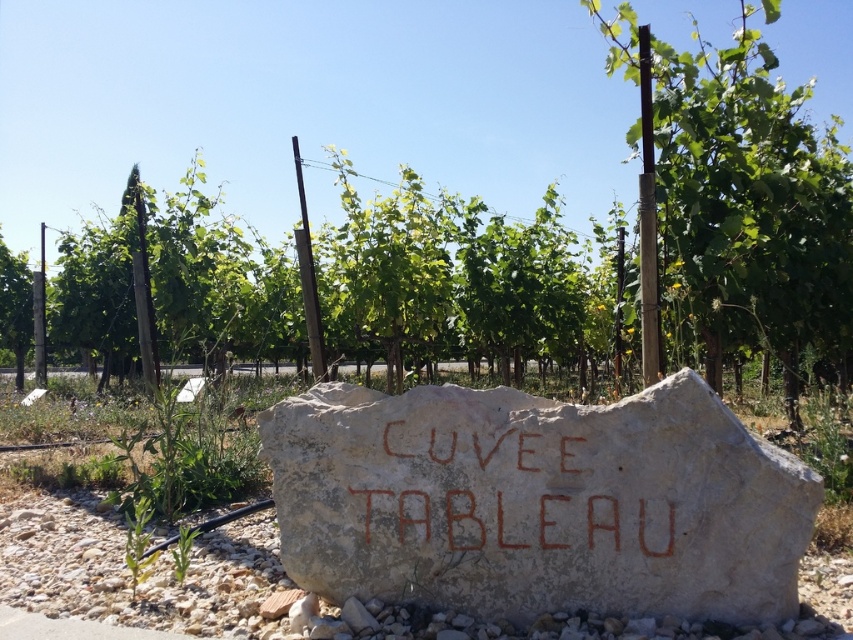
You are planning to plant a new grapevine in the vineyard. You want to ensure it has enough space to grow without overcrowding. Considering the green leafy tree at center and the brown carved stone at center, which object should you use as a reference for spacing your new plant?

The green leafy tree at center has a larger width than the brown carved stone at center, so you should use the green leafy tree at center as a reference for spacing your new plant to ensure adequate space.